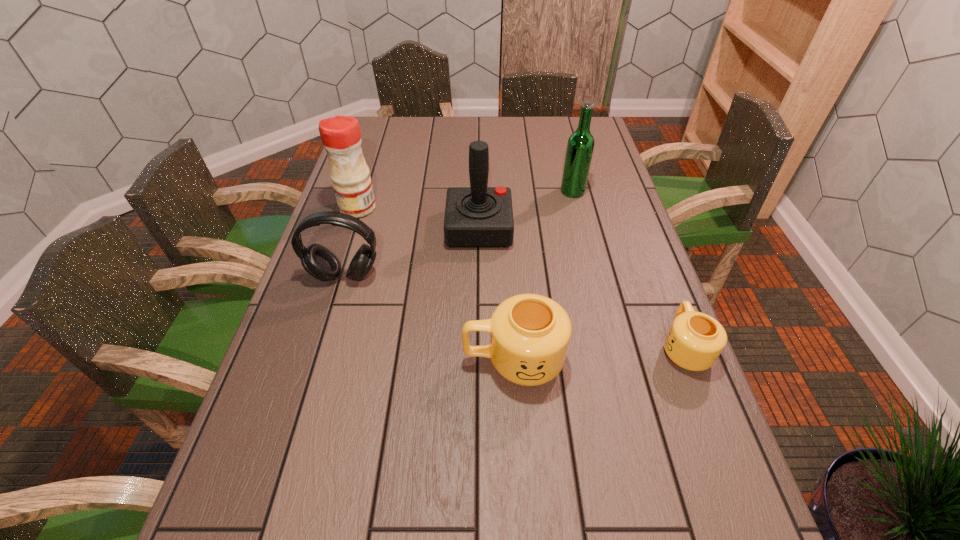
Locate an element on the screen. the fifth tallest object is located at coordinates (529, 333).

You are a GUI agent. You are given a task and a screenshot of the screen. Output one action in this format:
    pyautogui.click(x=<x>, y=<y>)
    Task: Click on the left mug
    The width and height of the screenshot is (960, 540).
    Given the screenshot: What is the action you would take?
    pyautogui.click(x=529, y=333)

This screenshot has height=540, width=960. I want to click on the shortest object, so click(695, 340).

I want to click on the rightmost object, so click(695, 340).

I want to click on condiment, so click(x=341, y=137).

Image resolution: width=960 pixels, height=540 pixels. I want to click on joystick, so click(x=478, y=216).

At what (x,y) coordinates should I click in order to perform the action: click on the second object from right to left. Please return your answer as a coordinate pair (x, y). The height and width of the screenshot is (540, 960). Looking at the image, I should click on (580, 146).

Find the location of `the fourth farthest object`. the fourth farthest object is located at coordinates (318, 261).

At what (x,y) coordinates should I click in order to perform the action: click on the fourth tallest object. Please return your answer as a coordinate pair (x, y). This screenshot has width=960, height=540. Looking at the image, I should click on (318, 261).

Image resolution: width=960 pixels, height=540 pixels. Identify the location of free space located on the handle side of the taller mug. (352, 360).